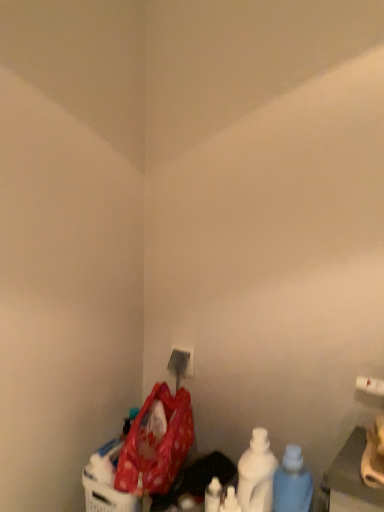
Describe the element at coordinates (256, 474) in the screenshot. The width and height of the screenshot is (384, 512). I see `white matte bottle at lower right, acting as the second bottle starting from the right` at that location.

What is the approximate width of white matte bottle at lower right, which ranks as the second bottle in left-to-right order?

3.57 inches.

In order to face white plastic electric outlet at lower center, should I rotate leftwards or rightwards?

Rotate left and turn 1.365 degrees.

Describe the element at coordinates (213, 496) in the screenshot. I see `white matte bottle at lower center, positioned as the 3th bottle in right-to-left order` at that location.

This screenshot has width=384, height=512. I want to click on polka dot fabric bag at lower left, so click(156, 445).

Does polka dot fabric bag at lower left turn towards blue translucent bottle at lower right, the third bottle viewed from the left?

No, polka dot fabric bag at lower left is not facing towards blue translucent bottle at lower right, the third bottle viewed from the left.

Considering the positions of objects polka dot fabric bag at lower left and blue translucent bottle at lower right, which appears as the 1th bottle when viewed from the right, in the image provided, who is behind, polka dot fabric bag at lower left or blue translucent bottle at lower right, which appears as the 1th bottle when viewed from the right,?

polka dot fabric bag at lower left is more distant.

How different are the orientations of polka dot fabric bag at lower left and blue translucent bottle at lower right, the third bottle viewed from the left, in degrees?

polka dot fabric bag at lower left and blue translucent bottle at lower right, the third bottle viewed from the left, are facing 64.6 degrees away from each other.

Considering the sizes of objects polka dot fabric bag at lower left and blue translucent bottle at lower right, which appears as the 1th bottle when viewed from the right, in the image provided, who is smaller, polka dot fabric bag at lower left or blue translucent bottle at lower right, which appears as the 1th bottle when viewed from the right,?

blue translucent bottle at lower right, which appears as the 1th bottle when viewed from the right, is smaller.

At what (x,y) coordinates should I click in order to perform the action: click on waste above the white matte bottle at lower center, arranged as the first bottle when viewed from the left (from the image's perspective). Please return your answer as a coordinate pair (x, y). Looking at the image, I should click on (156, 445).

Is polka dot fabric bag at lower left facing towards white matte bottle at lower center, arranged as the first bottle when viewed from the left?

No, polka dot fabric bag at lower left is not aimed at white matte bottle at lower center, arranged as the first bottle when viewed from the left.

Between polka dot fabric bag at lower left and white matte bottle at lower center, positioned as the 3th bottle in right-to-left order, which one appears on the right side from the viewer's perspective?

From the viewer's perspective, white matte bottle at lower center, positioned as the 3th bottle in right-to-left order, appears more on the right side.

Where is `waste in front of the white matte bottle at lower right, acting as the second bottle starting from the right`? waste in front of the white matte bottle at lower right, acting as the second bottle starting from the right is located at coordinates (156, 445).

Is white matte bottle at lower right, acting as the second bottle starting from the right, in contact with polka dot fabric bag at lower left?

white matte bottle at lower right, acting as the second bottle starting from the right, and polka dot fabric bag at lower left are clearly separated.

How different are the orientations of white matte bottle at lower right, which ranks as the second bottle in left-to-right order, and polka dot fabric bag at lower left in degrees?

They differ by 64.6 degrees in their facing directions.

Considering the relative positions of white matte bottle at lower right, which ranks as the second bottle in left-to-right order, and polka dot fabric bag at lower left in the image provided, is white matte bottle at lower right, which ranks as the second bottle in left-to-right order, to the right of polka dot fabric bag at lower left from the viewer's perspective?

Yes, white matte bottle at lower right, which ranks as the second bottle in left-to-right order, is to the right of polka dot fabric bag at lower left.

From the image's perspective, is white plastic electric outlet at lower center located beneath blue translucent bottle at lower right, which appears as the 1th bottle when viewed from the right?

No, from the image's perspective, white plastic electric outlet at lower center is not below blue translucent bottle at lower right, which appears as the 1th bottle when viewed from the right.

In the scene shown: Is white plastic electric outlet at lower center far from blue translucent bottle at lower right, which appears as the 1th bottle when viewed from the right?

white plastic electric outlet at lower center is actually quite close to blue translucent bottle at lower right, which appears as the 1th bottle when viewed from the right.

Is white plastic electric outlet at lower center spatially inside blue translucent bottle at lower right, which appears as the 1th bottle when viewed from the right, or outside of it?

white plastic electric outlet at lower center lies outside blue translucent bottle at lower right, which appears as the 1th bottle when viewed from the right.

Is white matte bottle at lower right, which ranks as the second bottle in left-to-right order, outside of white plastic electric outlet at lower center?

Yes.

Does point (253, 442) lie in front of point (179, 374)?

Yes, it is.

From the image's perspective, between white matte bottle at lower right, which ranks as the second bottle in left-to-right order, and white plastic electric outlet at lower center, which one is located above?

white plastic electric outlet at lower center.

Based on the photo, does white matte bottle at lower right, which ranks as the second bottle in left-to-right order, turn towards white plastic electric outlet at lower center?

No, white matte bottle at lower right, which ranks as the second bottle in left-to-right order, is not facing towards white plastic electric outlet at lower center.

Which is in front, point (143, 480) or point (185, 368)?

Positioned in front is point (143, 480).

Is polka dot fabric bag at lower left outside of white plastic electric outlet at lower center?

That's correct, polka dot fabric bag at lower left is outside of white plastic electric outlet at lower center.

Does polka dot fabric bag at lower left have a greater width compared to white plastic electric outlet at lower center?

Yes.

From the image's perspective, which one is positioned higher, polka dot fabric bag at lower left or white plastic electric outlet at lower center?

white plastic electric outlet at lower center is shown above in the image.

Is blue translucent bottle at lower right, which appears as the 1th bottle when viewed from the right, directly adjacent to white matte bottle at lower right, which ranks as the second bottle in left-to-right order?

Indeed, blue translucent bottle at lower right, which appears as the 1th bottle when viewed from the right, and white matte bottle at lower right, which ranks as the second bottle in left-to-right order, are beside each other and touching.

Is blue translucent bottle at lower right, the third bottle viewed from the left, facing away from white matte bottle at lower right, which ranks as the second bottle in left-to-right order?

No, white matte bottle at lower right, which ranks as the second bottle in left-to-right order, is not at the back of blue translucent bottle at lower right, the third bottle viewed from the left.

Is blue translucent bottle at lower right, which appears as the 1th bottle when viewed from the right, bigger than white matte bottle at lower right, acting as the second bottle starting from the right?

Correct, blue translucent bottle at lower right, which appears as the 1th bottle when viewed from the right, is larger in size than white matte bottle at lower right, acting as the second bottle starting from the right.

Is point (297, 481) closer or farther from the camera than point (252, 496)?

Point (297, 481) is positioned closer to the camera compared to point (252, 496).

Which bottle is the 2nd one when counting from the front of the polka dot fabric bag at lower left? Please provide its 2D coordinates.

[(292, 483)]

There is a polka dot fabric bag at lower left. Where is `the 3rd bottle below it (from the image's perspective)`? The height and width of the screenshot is (512, 384). the 3rd bottle below it (from the image's perspective) is located at coordinates (213, 496).

Estimate the real-world distances between objects in this image. Which object is further from white plastic electric outlet at lower center, white matte bottle at lower right, acting as the second bottle starting from the right, or white matte bottle at lower center, positioned as the 3th bottle in right-to-left order?

Based on the image, white matte bottle at lower center, positioned as the 3th bottle in right-to-left order, appears to be further to white plastic electric outlet at lower center.

From the image, which object appears to be farther from white matte bottle at lower right, which ranks as the second bottle in left-to-right order, white matte bottle at lower center, arranged as the first bottle when viewed from the left, or blue translucent bottle at lower right, which appears as the 1th bottle when viewed from the right?

Based on the image, white matte bottle at lower center, arranged as the first bottle when viewed from the left, appears to be further to white matte bottle at lower right, which ranks as the second bottle in left-to-right order.

From the image, which object appears to be farther from polka dot fabric bag at lower left, white plastic electric outlet at lower center or white matte bottle at lower right, acting as the second bottle starting from the right?

white matte bottle at lower right, acting as the second bottle starting from the right, is further to polka dot fabric bag at lower left.

When comparing their distances from white matte bottle at lower right, acting as the second bottle starting from the right, does blue translucent bottle at lower right, which appears as the 1th bottle when viewed from the right, or white plastic electric outlet at lower center seem closer?

Among the two, blue translucent bottle at lower right, which appears as the 1th bottle when viewed from the right, is located nearer to white matte bottle at lower right, acting as the second bottle starting from the right.

When comparing their distances from blue translucent bottle at lower right, the third bottle viewed from the left, does white matte bottle at lower right, acting as the second bottle starting from the right, or white plastic electric outlet at lower center seem further?

Based on the image, white plastic electric outlet at lower center appears to be further to blue translucent bottle at lower right, the third bottle viewed from the left.

In the scene shown: When comparing their distances from blue translucent bottle at lower right, which appears as the 1th bottle when viewed from the right, does white matte bottle at lower right, acting as the second bottle starting from the right, or white matte bottle at lower center, positioned as the 3th bottle in right-to-left order, seem further?

white matte bottle at lower center, positioned as the 3th bottle in right-to-left order.

Based on their spatial positions, is polka dot fabric bag at lower left or white matte bottle at lower center, arranged as the first bottle when viewed from the left, further from blue translucent bottle at lower right, which appears as the 1th bottle when viewed from the right?

polka dot fabric bag at lower left is further to blue translucent bottle at lower right, which appears as the 1th bottle when viewed from the right.

From the image, which object appears to be nearer to polka dot fabric bag at lower left, blue translucent bottle at lower right, which appears as the 1th bottle when viewed from the right, or white plastic electric outlet at lower center?

white plastic electric outlet at lower center is closer to polka dot fabric bag at lower left.

Identify the location of waste between white matte bottle at lower center, arranged as the first bottle when viewed from the left, and white plastic electric outlet at lower center from front to back. (156, 445).

This screenshot has width=384, height=512. Find the location of `bottle between white matte bottle at lower center, positioned as the 3th bottle in right-to-left order, and white plastic electric outlet at lower center in the front-back direction`. bottle between white matte bottle at lower center, positioned as the 3th bottle in right-to-left order, and white plastic electric outlet at lower center in the front-back direction is located at coordinates (256, 474).

I want to click on bottle between white matte bottle at lower center, positioned as the 3th bottle in right-to-left order, and blue translucent bottle at lower right, the third bottle viewed from the left, in the horizontal direction, so click(256, 474).

The width and height of the screenshot is (384, 512). I want to click on bottle between polka dot fabric bag at lower left and white matte bottle at lower right, which ranks as the second bottle in left-to-right order, so click(x=213, y=496).